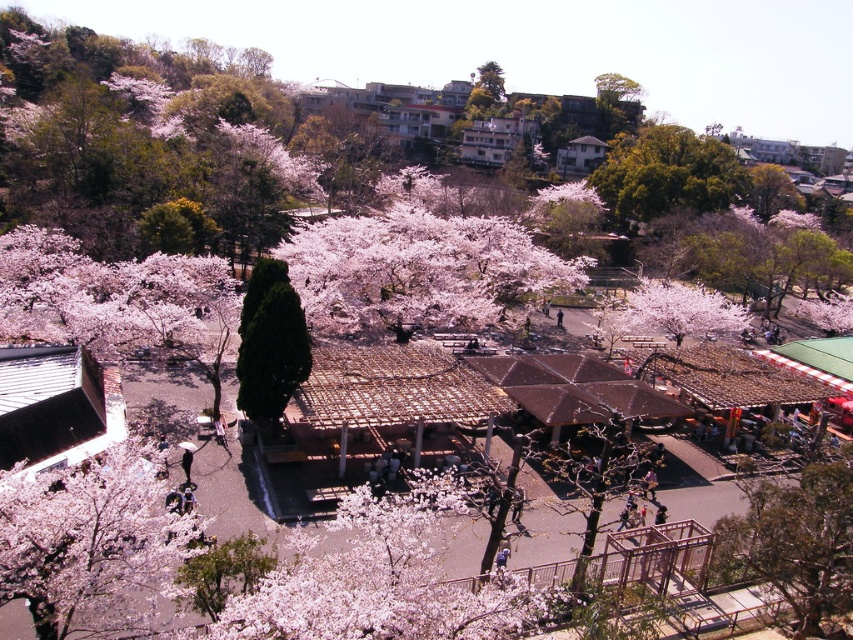
Question: Is fluffy pink blossoms at lower left thinner than green textured tree at lower right?

Choices:
 (A) yes
 (B) no

Answer: (A)

Question: Which object is positioned closest to the bare wood tree at center?

Choices:
 (A) green leafy tree at upper center
 (B) fluffy pink blossoms at lower left
 (C) pink matte flower at center
 (D) dark green textured tree at center

Answer: (D)

Question: Which point is closer to the camera?

Choices:
 (A) (248, 378)
 (B) (38, 618)

Answer: (B)

Question: Which point appears farthest from the camera in this image?

Choices:
 (A) (50, 584)
 (B) (241, 324)
 (C) (744, 534)

Answer: (B)

Question: Is fluffy pink blossoms at lower left in front of bare wood tree at center?

Choices:
 (A) yes
 (B) no

Answer: (A)

Question: Is pink matte flower at center in front of bare wood tree at center?

Choices:
 (A) yes
 (B) no

Answer: (B)